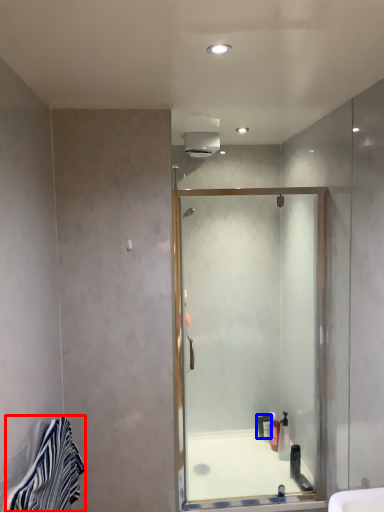
Question: Among these objects, which one is farthest to the camera, material (highlighted by a red box) or toiletry (highlighted by a blue box)?

Choices:
 (A) material
 (B) toiletry

Answer: (B)